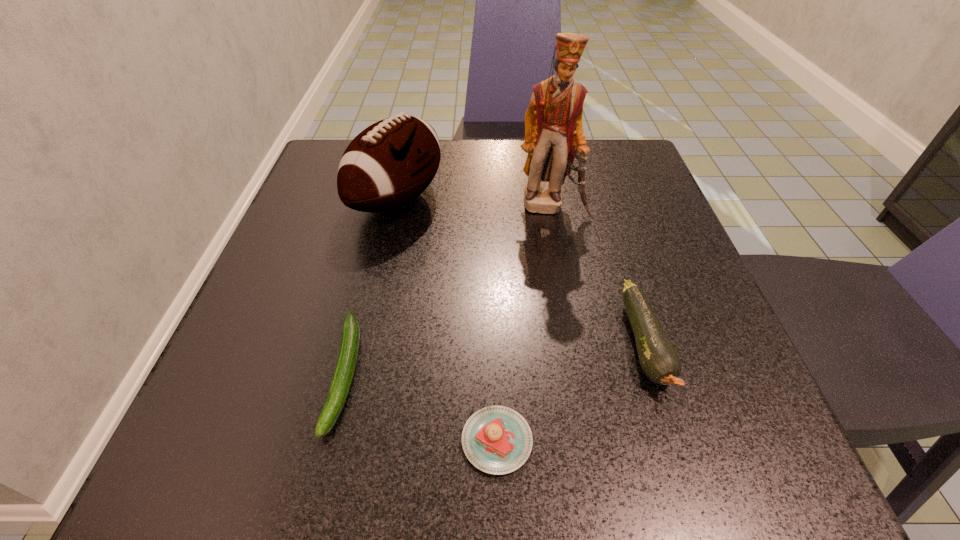
The width and height of the screenshot is (960, 540). What are the coordinates of `vacant space that is in between the third object from left to right and the left zucchini` in the screenshot? It's located at coord(420,407).

I want to click on vacant area between the shorter zucchini and the football (American), so click(372, 287).

The image size is (960, 540). In order to click on free space that is in between the third object from left to right and the second object from right to left in this screenshot , I will do `click(524, 323)`.

You are a GUI agent. You are given a task and a screenshot of the screen. Output one action in this format:
    pyautogui.click(x=<x>, y=<y>)
    Task: Click on the free space between the nutcracker and the right zucchini
    Image resolution: width=960 pixels, height=540 pixels.
    Given the screenshot: What is the action you would take?
    pyautogui.click(x=598, y=275)

Where is `vacant region between the tallest object and the left zucchini`? This screenshot has width=960, height=540. vacant region between the tallest object and the left zucchini is located at coordinates (448, 290).

You are a GUI agent. You are given a task and a screenshot of the screen. Output one action in this format:
    pyautogui.click(x=<x>, y=<y>)
    Task: Click on the vacant point located between the fourth object from left to right and the football (American)
    The width and height of the screenshot is (960, 540).
    Given the screenshot: What is the action you would take?
    pyautogui.click(x=474, y=203)

Where is `object that is the third nearest to the pastry`? The image size is (960, 540). object that is the third nearest to the pastry is located at coordinates tap(390, 163).

At what (x,y) coordinates should I click in order to perform the action: click on the fourth closest object to the rightmost object. Please return your answer as a coordinate pair (x, y). The height and width of the screenshot is (540, 960). Looking at the image, I should click on (348, 353).

Find the location of `free spot that satisfies the following two spatial constraints: 1. on the front-facing side of the left zucchini; 2. on the right side of the pastry`. free spot that satisfies the following two spatial constraints: 1. on the front-facing side of the left zucchini; 2. on the right side of the pastry is located at coordinates (328, 441).

Where is `vacant point that satisfies the following two spatial constraints: 1. on the front-facing side of the left zucchini; 2. on the left side of the third object from left to right`? The height and width of the screenshot is (540, 960). vacant point that satisfies the following two spatial constraints: 1. on the front-facing side of the left zucchini; 2. on the left side of the third object from left to right is located at coordinates (328, 441).